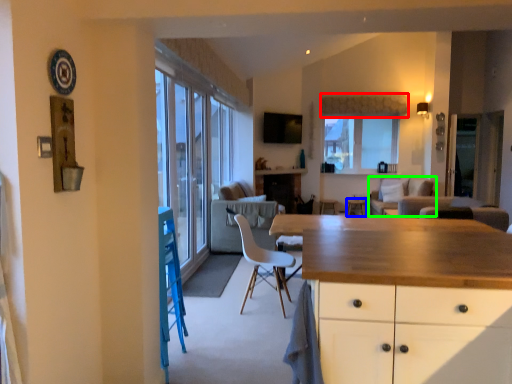
Question: Which is nearer to the curtain (highlighted by a red box)? table (highlighted by a blue box) or couch (highlighted by a green box).

Choices:
 (A) table
 (B) couch

Answer: (B)